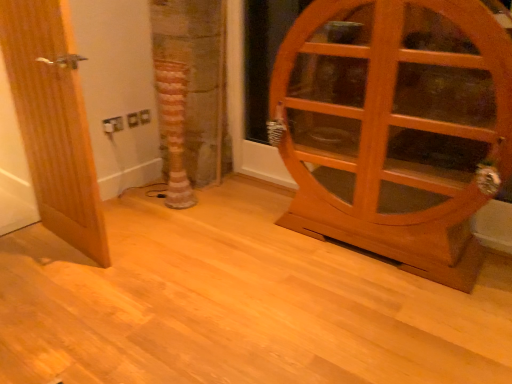
Question: From the image's perspective, is wooden cabinet at right, placed as the second door when sorted from left to right, beneath striped fabric tree trunk at center?

Choices:
 (A) no
 (B) yes

Answer: (B)

Question: Is wooden cabinet at right, acting as the 1th door starting from the right, oriented towards striped fabric tree trunk at center?

Choices:
 (A) no
 (B) yes

Answer: (A)

Question: From a real-world perspective, is wooden cabinet at right, placed as the second door when sorted from left to right, positioned over striped fabric tree trunk at center based on gravity?

Choices:
 (A) no
 (B) yes

Answer: (B)

Question: Is wooden cabinet at right, placed as the second door when sorted from left to right, at the left side of striped fabric tree trunk at center?

Choices:
 (A) yes
 (B) no

Answer: (B)

Question: Is striped fabric tree trunk at center inside wooden cabinet at right, acting as the 1th door starting from the right?

Choices:
 (A) no
 (B) yes

Answer: (A)

Question: Is wooden cabinet at right, acting as the 1th door starting from the right, to the left or to the right of striped fabric tree trunk at center in the image?

Choices:
 (A) right
 (B) left

Answer: (A)

Question: Is wooden cabinet at right, acting as the 1th door starting from the right, inside the boundaries of striped fabric tree trunk at center, or outside?

Choices:
 (A) inside
 (B) outside

Answer: (B)

Question: Considering the positions of wooden cabinet at right, placed as the second door when sorted from left to right, and striped fabric tree trunk at center in the image, is wooden cabinet at right, placed as the second door when sorted from left to right, wider or thinner than striped fabric tree trunk at center?

Choices:
 (A) wide
 (B) thin

Answer: (A)

Question: Is wooden cabinet at right, acting as the 1th door starting from the right, taller or shorter than striped fabric tree trunk at center?

Choices:
 (A) short
 (B) tall

Answer: (B)

Question: From a real-world perspective, is striped fabric tree trunk at center physically located above or below wooden door at left, the 2th door from the right?

Choices:
 (A) below
 (B) above

Answer: (A)

Question: Considering the positions of point (162, 79) and point (92, 206), is point (162, 79) closer or farther from the camera than point (92, 206)?

Choices:
 (A) farther
 (B) closer

Answer: (A)

Question: Considering the positions of striped fabric tree trunk at center and wooden door at left, which is counted as the 1th door, starting from the left, in the image, is striped fabric tree trunk at center bigger or smaller than wooden door at left, which is counted as the 1th door, starting from the left,?

Choices:
 (A) small
 (B) big

Answer: (A)

Question: Considering their positions, is striped fabric tree trunk at center located in front of or behind wooden door at left, which is counted as the 1th door, starting from the left?

Choices:
 (A) front
 (B) behind

Answer: (B)

Question: Does point (174, 79) appear closer or farther from the camera than point (418, 115)?

Choices:
 (A) closer
 (B) farther

Answer: (B)

Question: Considering the positions of striped fabric tree trunk at center and wooden cabinet at right, acting as the 1th door starting from the right, in the image, is striped fabric tree trunk at center taller or shorter than wooden cabinet at right, acting as the 1th door starting from the right,?

Choices:
 (A) short
 (B) tall

Answer: (A)